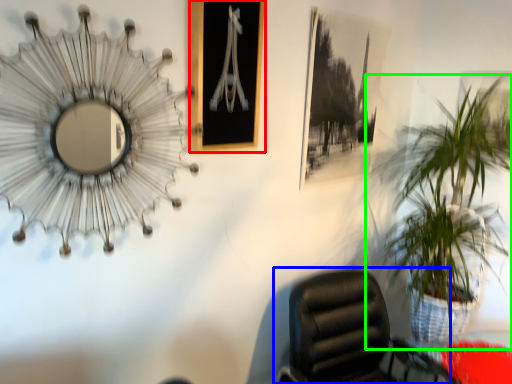
Question: Based on their relative distances, which object is nearer to picture frame (highlighted by a red box)? Choose from chair (highlighted by a blue box) and houseplant (highlighted by a green box).

Choices:
 (A) chair
 (B) houseplant

Answer: (A)